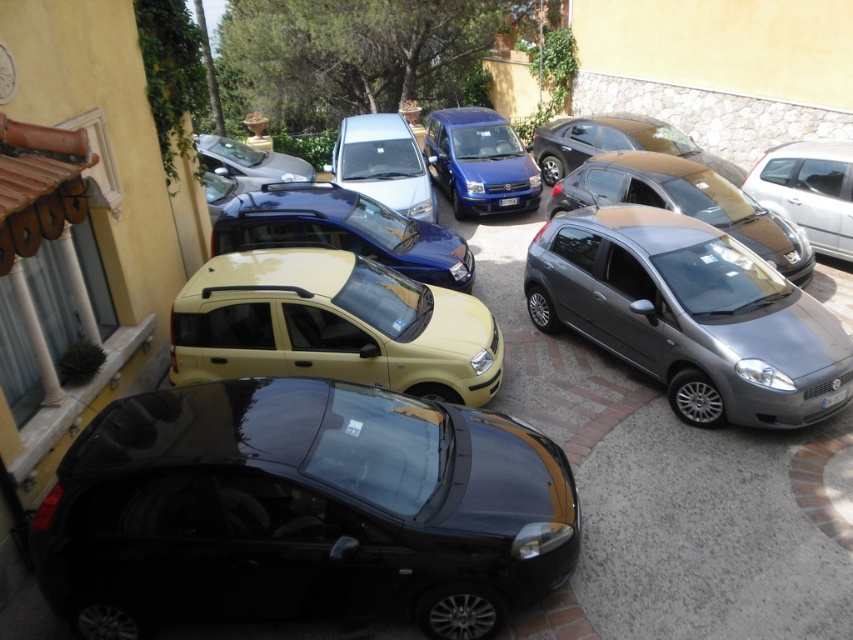
Question: Which object appears closest to the camera in this image?

Choices:
 (A) matte blue van at center
 (B) satin silver hatchback at center
 (C) metallic silver hatchback at center
 (D) metallic gold sedan at center

Answer: (B)

Question: Among these points, which one is farthest from the camera?

Choices:
 (A) coord(485,205)
 (B) coord(515,198)
 (C) coord(270,182)
 (D) coord(376,262)

Answer: (C)

Question: Can you confirm if metallic silver hatchback at center is smaller than metallic silver car at upper center?

Choices:
 (A) yes
 (B) no

Answer: (B)

Question: Does glossy blue hatchback at center have a larger size compared to metallic silver car at upper center?

Choices:
 (A) yes
 (B) no

Answer: (A)

Question: Observing the image, what is the correct spatial positioning of matte blue van at center in reference to metallic gold sedan at center?

Choices:
 (A) right
 (B) left

Answer: (B)

Question: Which of the following is the closest to the observer?

Choices:
 (A) (299, 186)
 (B) (732, 294)

Answer: (B)